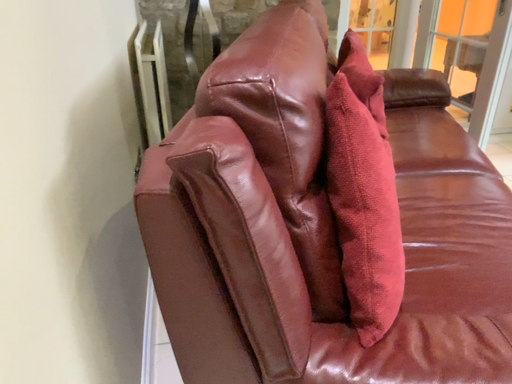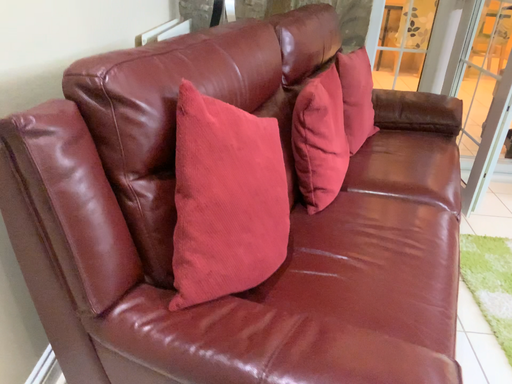
Question: Which way did the camera rotate in the video?

Choices:
 (A) rotated right
 (B) rotated left

Answer: (B)